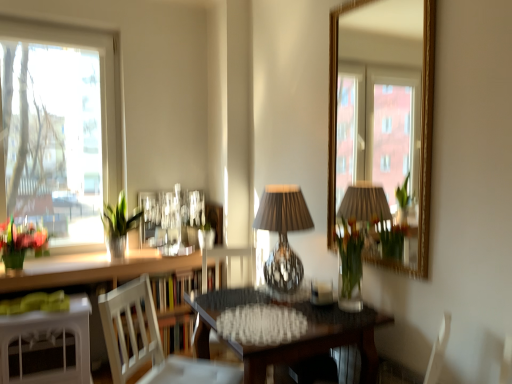
Question: Looking at the image, does wooden textured table at center, placed as the 1th table when sorted from right to left, seem bigger or smaller compared to white wood chair at center, which appears as the 1th chair when viewed from the back?

Choices:
 (A) small
 (B) big

Answer: (B)

Question: From a real-world perspective, is wooden textured table at center, which appears as the 2th table when viewed from the left, physically located above or below white wood chair at center, the 2th chair positioned from the front?

Choices:
 (A) above
 (B) below

Answer: (A)

Question: Based on their relative distances, which object is farther from the white wood chair at center, which is the second chair from back to front?

Choices:
 (A) white wood table at lower left, placed as the 2th table when sorted from right to left
 (B) white glossy counter top at lower left
 (C) shiny glass table lamp at center
 (D) vibrant floral bouquet at left
 (E) clear glass window at left

Answer: (E)

Question: Considering the real-world distances, which object is farthest from the clear glass window at left?

Choices:
 (A) vibrant floral bouquet at left
 (B) wooden textured table at center, placed as the 1th table when sorted from right to left
 (C) white wood table at lower left, the 1th table in the left-to-right sequence
 (D) green glass vase at left
 (E) translucent glass vase at center

Answer: (E)